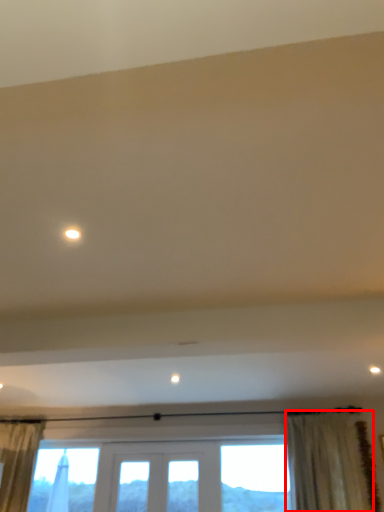
Question: From the image's perspective, what is the correct spatial positioning of curtain (annotated by the red box) in reference to light?

Choices:
 (A) above
 (B) below

Answer: (B)